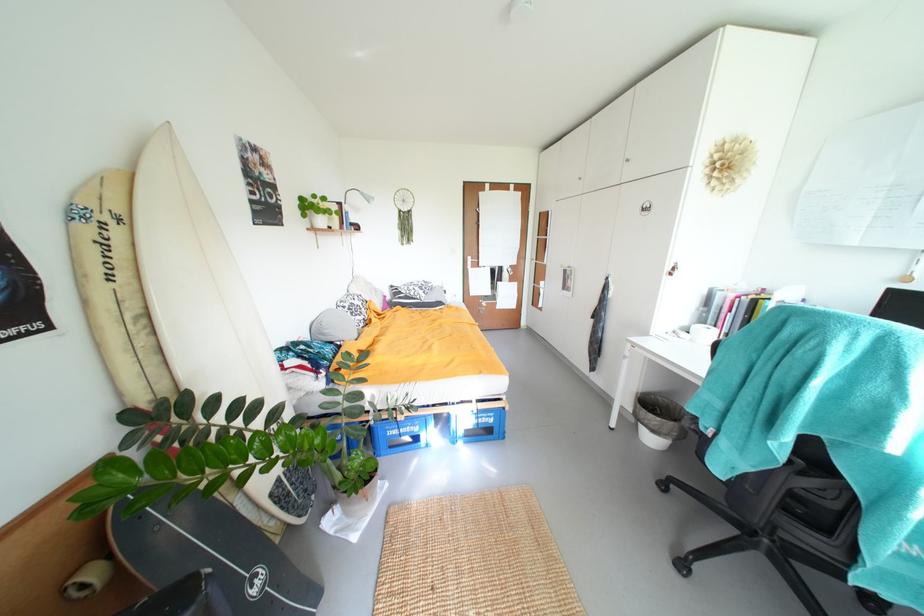
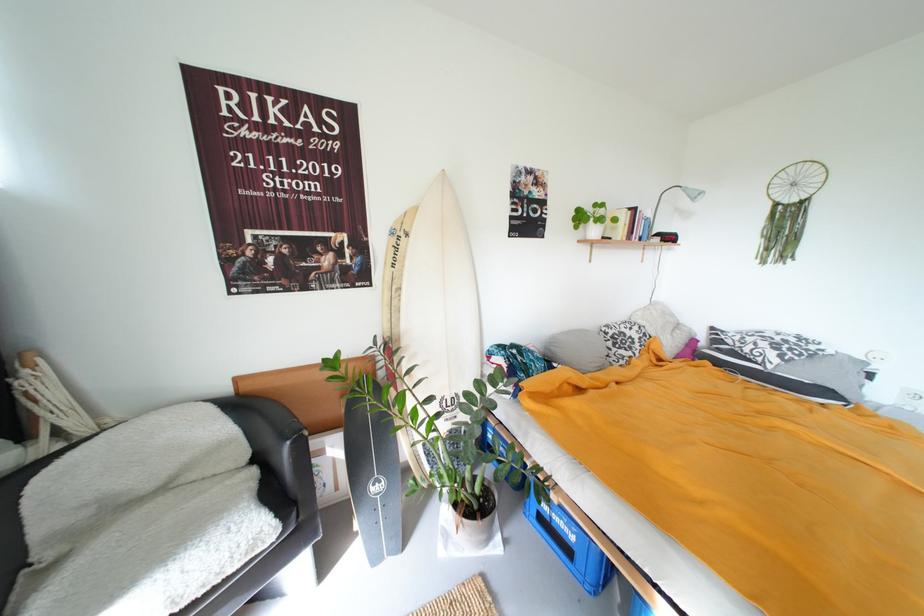
The point at (x=148, y=346) is marked in the first image. Where is the corresponding point in the second image?

(402, 306)